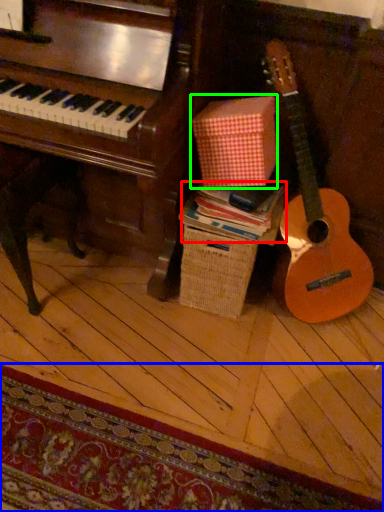
Question: Which object is positioned closest to book (highlighted by a red box)? Select from mat (highlighted by a blue box) and cardboard box (highlighted by a green box).

Choices:
 (A) mat
 (B) cardboard box

Answer: (B)